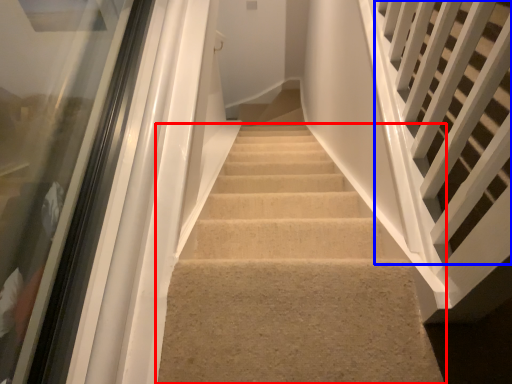
Question: Which object appears closest to the camera in this image, stairs (highlighted by a red box) or stairs (highlighted by a blue box)?

Choices:
 (A) stairs
 (B) stairs

Answer: (B)